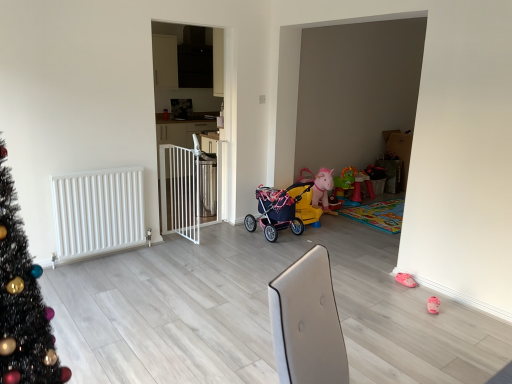
Question: Does white matte radiator at left have a larger size compared to white metal gate at center?

Choices:
 (A) no
 (B) yes

Answer: (A)

Question: From a real-world perspective, is white matte radiator at left physically below white metal gate at center?

Choices:
 (A) yes
 (B) no

Answer: (A)

Question: From the image's perspective, does white matte radiator at left appear higher than white metal gate at center?

Choices:
 (A) no
 (B) yes

Answer: (A)

Question: Is white matte radiator at left not close to white metal gate at center?

Choices:
 (A) no
 (B) yes

Answer: (B)

Question: Is white metal gate at center a part of white matte radiator at left?

Choices:
 (A) no
 (B) yes

Answer: (A)

Question: From their relative heights in the image, would you say white metal gate at center is taller or shorter than matte pink stroller at center?

Choices:
 (A) short
 (B) tall

Answer: (B)

Question: From a real-world perspective, is white metal gate at center above or below matte pink stroller at center?

Choices:
 (A) below
 (B) above

Answer: (B)

Question: Is white metal gate at center bigger or smaller than matte pink stroller at center?

Choices:
 (A) small
 (B) big

Answer: (B)

Question: Is white metal gate at center to the left or to the right of matte pink stroller at center in the image?

Choices:
 (A) right
 (B) left

Answer: (B)

Question: Is white plastic gate at center in front of or behind white matte radiator at left in the image?

Choices:
 (A) behind
 (B) front

Answer: (A)

Question: From a real-world perspective, is white plastic gate at center positioned above or below white matte radiator at left?

Choices:
 (A) below
 (B) above

Answer: (B)

Question: In the image, is white plastic gate at center on the left side or the right side of white matte radiator at left?

Choices:
 (A) right
 (B) left

Answer: (A)

Question: Does point (182, 185) appear closer or farther from the camera than point (101, 203)?

Choices:
 (A) closer
 (B) farther

Answer: (B)

Question: Considering the positions of white plastic gate at center and pink fabric baby carriage at center in the image, is white plastic gate at center taller or shorter than pink fabric baby carriage at center?

Choices:
 (A) tall
 (B) short

Answer: (A)

Question: Which is correct: white plastic gate at center is inside pink fabric baby carriage at center, or outside of it?

Choices:
 (A) inside
 (B) outside

Answer: (B)